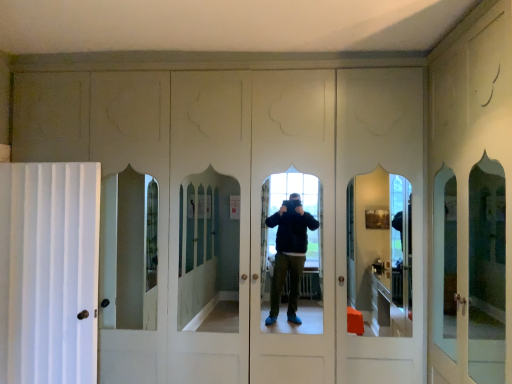
In order to face white matte screen door at right, should I rotate leftwards or rightwards?

You should look right and rotate roughly 31.293 degrees.

What is the approximate width of white matte screen door at right?

white matte screen door at right is 23.21 inches wide.

The image size is (512, 384). What do you see at coordinates (469, 275) in the screenshot? I see `white matte screen door at right` at bounding box center [469, 275].

Locate an element on the screen. The height and width of the screenshot is (384, 512). white matte screen door at right is located at coordinates (469, 275).

This screenshot has width=512, height=384. What do you see at coordinates (49, 272) in the screenshot? I see `white fabric curtain at left` at bounding box center [49, 272].

Locate an element on the screen. This screenshot has width=512, height=384. white fabric curtain at left is located at coordinates (x=49, y=272).

You are a GUI agent. You are given a task and a screenshot of the screen. Output one action in this format:
    pyautogui.click(x=<x>, y=<y>)
    Task: Click on the white matte screen door at right
    The height and width of the screenshot is (384, 512).
    Given the screenshot: What is the action you would take?
    pyautogui.click(x=469, y=275)

Considering the positions of objects white fabric curtain at left and white matte screen door at right in the image provided, who is more to the right, white fabric curtain at left or white matte screen door at right?

From the viewer's perspective, white matte screen door at right appears more on the right side.

In the image, is white fabric curtain at left positioned in front of or behind white matte screen door at right?

white fabric curtain at left is positioned farther from the viewer than white matte screen door at right.

Between point (22, 369) and point (433, 372), which one is positioned behind?

Point (22, 369)

From the image's perspective, would you say white fabric curtain at left is positioned over white matte screen door at right?

No.

From a real-world perspective, which is physically below, white fabric curtain at left or white matte screen door at right?

white fabric curtain at left, from a real-world perspective.

Between white fabric curtain at left and white matte screen door at right, which one has larger width?

With larger width is white matte screen door at right.

Does white fabric curtain at left have a greater height compared to white matte screen door at right?

No.

Considering the sizes of white fabric curtain at left and white matte screen door at right in the image, is white fabric curtain at left bigger or smaller than white matte screen door at right?

Considering their sizes, white fabric curtain at left takes up less space than white matte screen door at right.

Could white matte screen door at right be considered to be inside white fabric curtain at left?

No.

Is white fabric curtain at left next to white matte screen door at right and touching it?

No, white fabric curtain at left is not making contact with white matte screen door at right.

Is white fabric curtain at left facing towards white matte screen door at right?

No, white fabric curtain at left is not aimed at white matte screen door at right.

You are a GUI agent. You are given a task and a screenshot of the screen. Output one action in this format:
    pyautogui.click(x=<x>, y=<y>)
    Task: Click on the curtain directly beneath the white matte screen door at right (from a real-world perspective)
    
    Given the screenshot: What is the action you would take?
    pyautogui.click(x=49, y=272)

Can you confirm if white matte screen door at right is positioned to the left of white fabric curtain at left?

No.

Is white matte screen door at right in front of or behind white fabric curtain at left in the image?

In the image, white matte screen door at right appears in front of white fabric curtain at left.

Is point (456, 359) positioned in front of point (2, 279)?

Yes, point (456, 359) is closer to viewer.

From the image's perspective, is white matte screen door at right above white fabric curtain at left?

Yes.

Looking at this image, from a real-world perspective, is white matte screen door at right over white fabric curtain at left?

Yes, from a real-world perspective, white matte screen door at right is above white fabric curtain at left.

Is white matte screen door at right wider or thinner than white fabric curtain at left?

white matte screen door at right is wider than white fabric curtain at left.

Who is shorter, white matte screen door at right or white fabric curtain at left?

With less height is white fabric curtain at left.

Which of these two, white matte screen door at right or white fabric curtain at left, is bigger?

white matte screen door at right.

Is white matte screen door at right not within white fabric curtain at left?

Yes, white matte screen door at right is located beyond the bounds of white fabric curtain at left.

Is there a large distance between white matte screen door at right and white fabric curtain at left?

Indeed, white matte screen door at right is not near white fabric curtain at left.

Is white matte screen door at right facing away from white fabric curtain at left?

white matte screen door at right is not turned away from white fabric curtain at left.

Where is `curtain to the left of white matte screen door at right`? The height and width of the screenshot is (384, 512). curtain to the left of white matte screen door at right is located at coordinates point(49,272).

You are a GUI agent. You are given a task and a screenshot of the screen. Output one action in this format:
    pyautogui.click(x=<x>, y=<y>)
    Task: Click on the screen door in front of the white fabric curtain at left
    This screenshot has height=384, width=512.
    Given the screenshot: What is the action you would take?
    tap(469, 275)

Identify the location of curtain that is under the white matte screen door at right (from a real-world perspective). The image size is (512, 384). (49, 272).